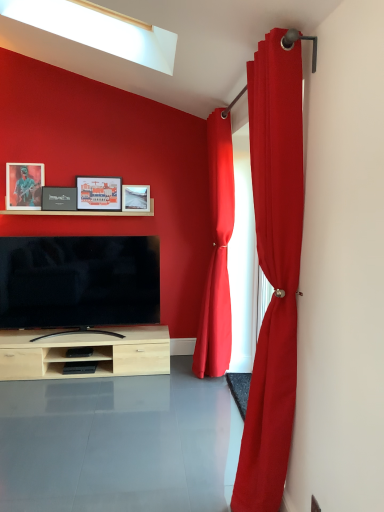
At what (x,y) coordinates should I click in order to perform the action: click on matte black picture frame at center, which appears as the second picture frame when viewed from the left. Please return your answer as a coordinate pair (x, y). Image resolution: width=384 pixels, height=512 pixels. Looking at the image, I should click on (58, 198).

How much space does matte black picture frame at upper left, positioned as the fourth picture frame in right-to-left order, occupy vertically?

17.07 inches.

Identify the location of matte paper picture frame at upper center, which is the second picture frame in right-to-left order. The image size is (384, 512). (99, 193).

This screenshot has width=384, height=512. Describe the element at coordinates (217, 254) in the screenshot. I see `matte red curtain at right, which is the first curtain in back-to-front order` at that location.

Locate an element on the screen. The height and width of the screenshot is (512, 384). matte red curtain at right, which is counted as the 1th curtain, starting from the front is located at coordinates (273, 269).

In the image, is matte red curtain at right, which is the first curtain in back-to-front order, positioned in front of or behind wooden shelf at upper center?

matte red curtain at right, which is the first curtain in back-to-front order, is in front of wooden shelf at upper center.

From the picture: In terms of width, does matte red curtain at right, which is the second curtain in front-to-back order, look wider or thinner when compared to wooden shelf at upper center?

Considering their sizes, matte red curtain at right, which is the second curtain in front-to-back order, looks broader than wooden shelf at upper center.

Between matte red curtain at right, which is the first curtain in back-to-front order, and wooden shelf at upper center, which one has more height?

matte red curtain at right, which is the first curtain in back-to-front order, is taller.

In the scene shown: Which object is positioned more to the left, matte red curtain at right, the 2th curtain viewed from the back, or matte black tv at center?

matte black tv at center.

In the scene shown: Could you tell me if matte red curtain at right, which is counted as the 1th curtain, starting from the front, is facing matte black tv at center?

No, matte red curtain at right, which is counted as the 1th curtain, starting from the front, is not facing towards matte black tv at center.

Is point (236, 495) less distant than point (92, 263)?

Yes, it is.

Is wooden shelf at upper center positioned far away from matte red curtain at right, which is counted as the 1th curtain, starting from the front?

wooden shelf at upper center is positioned a significant distance from matte red curtain at right, which is counted as the 1th curtain, starting from the front.

From the image's perspective, is wooden shelf at upper center above or below matte red curtain at right, the 2th curtain viewed from the back?

Clearly, from the image's perspective, wooden shelf at upper center is above matte red curtain at right, the 2th curtain viewed from the back.

Considering the points (47, 211) and (302, 131), which point is in front, point (47, 211) or point (302, 131)?

The point (302, 131) is in front.

Is wooden shelf at upper center looking in the opposite direction of matte red curtain at right, which is counted as the 1th curtain, starting from the front?

No, matte red curtain at right, which is counted as the 1th curtain, starting from the front, is not at the back of wooden shelf at upper center.

Which is correct: matte black tv at center is inside matte paper picture frame at upper center, which is counted as the third picture frame, starting from the left, or outside of it?

Result: matte black tv at center is spatially situated outside matte paper picture frame at upper center, which is counted as the third picture frame, starting from the left.

Considering the sizes of objects matte black tv at center and matte paper picture frame at upper center, which is the second picture frame in right-to-left order, in the image provided, who is shorter, matte black tv at center or matte paper picture frame at upper center, which is the second picture frame in right-to-left order,?

matte paper picture frame at upper center, which is the second picture frame in right-to-left order.

In order to click on television that is under the matte paper picture frame at upper center, which is the second picture frame in right-to-left order (from a real-world perspective) in this screenshot , I will do `click(79, 281)`.

Looking at the image, does matte black tv at center seem bigger or smaller compared to matte paper picture frame at upper center, which is the second picture frame in right-to-left order?

Clearly, matte black tv at center is larger in size than matte paper picture frame at upper center, which is the second picture frame in right-to-left order.

Can you confirm if matte wooden picture frame at center, which is counted as the 4th picture frame, starting from the left, is smaller than matte black tv at center?

Correct, matte wooden picture frame at center, which is counted as the 4th picture frame, starting from the left, occupies less space than matte black tv at center.

Which is closer, (130, 190) or (21, 269)?

Point (130, 190) appears to be farther away from the viewer than point (21, 269).

In the image, is matte wooden picture frame at center, which is counted as the 4th picture frame, starting from the left, positioned in front of or behind matte black tv at center?

Visually, matte wooden picture frame at center, which is counted as the 4th picture frame, starting from the left, is located behind matte black tv at center.

The height and width of the screenshot is (512, 384). There is a matte black picture frame at center, which appears as the second picture frame when viewed from the left. What are the coordinates of `the 1st picture frame above it (from the image's perspective)` in the screenshot? It's located at (136, 198).

Looking at their sizes, would you say matte wooden picture frame at center, which is counted as the 4th picture frame, starting from the left, is wider or thinner than matte black picture frame at center, which is counted as the third picture frame, starting from the right?

Considering their sizes, matte wooden picture frame at center, which is counted as the 4th picture frame, starting from the left, looks broader than matte black picture frame at center, which is counted as the third picture frame, starting from the right.

Would you say matte wooden picture frame at center, the first picture frame positioned from the right, contains matte black picture frame at center, which is counted as the third picture frame, starting from the right?

No, matte wooden picture frame at center, the first picture frame positioned from the right, does not contain matte black picture frame at center, which is counted as the third picture frame, starting from the right.

Which object is positioned more to the left, matte wooden picture frame at center, which is counted as the 4th picture frame, starting from the left, or matte black picture frame at center, which appears as the second picture frame when viewed from the left?

matte black picture frame at center, which appears as the second picture frame when viewed from the left, is more to the left.

Is point (138, 190) closer or farther from the camera than point (268, 438)?

Clearly, point (138, 190) is more distant from the camera than point (268, 438).

From the image's perspective, would you say matte wooden picture frame at center, which is counted as the 4th picture frame, starting from the left, is positioned over matte red curtain at right, which is counted as the 1th curtain, starting from the front?

Yes.

In terms of height, does matte wooden picture frame at center, the first picture frame positioned from the right, look taller or shorter compared to matte red curtain at right, which is counted as the 1th curtain, starting from the front?

Considering their sizes, matte wooden picture frame at center, the first picture frame positioned from the right, has less height than matte red curtain at right, which is counted as the 1th curtain, starting from the front.

Considering the positions of objects matte wooden picture frame at center, the first picture frame positioned from the right, and matte red curtain at right, the 2th curtain viewed from the back, in the image provided, who is behind, matte wooden picture frame at center, the first picture frame positioned from the right, or matte red curtain at right, the 2th curtain viewed from the back,?

matte wooden picture frame at center, the first picture frame positioned from the right, is further away from the camera.

The image size is (384, 512). Identify the location of shelf that is behind the matte red curtain at right, which is the second curtain in front-to-back order. tap(81, 212).

This screenshot has width=384, height=512. I want to click on curtain that is the 1st object above the matte black tv at center (from a real-world perspective), so click(273, 269).

Looking at the image, which one is located further to matte black tv at center, matte black picture frame at center, which is counted as the third picture frame, starting from the right, or matte red curtain at right, which is the first curtain in back-to-front order?

matte red curtain at right, which is the first curtain in back-to-front order.

Based on the photo, when comparing their distances from matte black picture frame at center, which is counted as the third picture frame, starting from the right, does wooden shelf at upper center or matte red curtain at right, which is the second curtain in front-to-back order, seem closer?

wooden shelf at upper center.

When comparing their distances from matte black picture frame at upper left, which appears as the first picture frame when viewed from the left, does wooden shelf at upper center or matte wooden picture frame at center, the first picture frame positioned from the right, seem closer?

Based on the image, wooden shelf at upper center appears to be nearer to matte black picture frame at upper left, which appears as the first picture frame when viewed from the left.

Estimate the real-world distances between objects in this image. Which object is closer to wooden shelf at upper center, matte red curtain at right, which is the second curtain in front-to-back order, or matte red curtain at right, which is counted as the 1th curtain, starting from the front?

matte red curtain at right, which is the second curtain in front-to-back order, is closer to wooden shelf at upper center.

Based on the photo, looking at the image, which one is located further to matte black picture frame at center, which appears as the second picture frame when viewed from the left, matte black tv at center or matte wooden picture frame at center, the first picture frame positioned from the right?

matte black tv at center.

From the image, which object appears to be farther from matte wooden picture frame at center, the first picture frame positioned from the right, matte black picture frame at upper left, which appears as the first picture frame when viewed from the left, or matte red curtain at right, which is the first curtain in back-to-front order?

The object further to matte wooden picture frame at center, the first picture frame positioned from the right, is matte red curtain at right, which is the first curtain in back-to-front order.

Consider the image. Which object lies further to the anchor point wooden shelf at upper center, matte wooden picture frame at center, which is counted as the 4th picture frame, starting from the left, or matte black picture frame at upper left, positioned as the fourth picture frame in right-to-left order?

Based on the image, matte black picture frame at upper left, positioned as the fourth picture frame in right-to-left order, appears to be further to wooden shelf at upper center.

When comparing their distances from matte red curtain at right, which is the second curtain in front-to-back order, does matte black tv at center or matte wooden picture frame at center, which is counted as the 4th picture frame, starting from the left, seem further?

The object further to matte red curtain at right, which is the second curtain in front-to-back order, is matte black tv at center.

At what (x,y) coordinates should I click in order to perform the action: click on television between matte red curtain at right, the 2th curtain viewed from the back, and matte black picture frame at upper left, which appears as the first picture frame when viewed from the left, along the z-axis. Please return your answer as a coordinate pair (x, y). Looking at the image, I should click on (79, 281).

At what (x,y) coordinates should I click in order to perform the action: click on television between wooden shelf at upper center and matte red curtain at right, which is the first curtain in back-to-front order. Please return your answer as a coordinate pair (x, y). The height and width of the screenshot is (512, 384). Looking at the image, I should click on (79, 281).

I want to click on shelf situated between matte black picture frame at upper left, which appears as the first picture frame when viewed from the left, and matte paper picture frame at upper center, which is the second picture frame in right-to-left order, from left to right, so click(81, 212).

This screenshot has width=384, height=512. What are the coordinates of `shelf between matte red curtain at right, the 2th curtain viewed from the back, and matte wooden picture frame at center, the first picture frame positioned from the right, from front to back` in the screenshot? It's located at (81, 212).